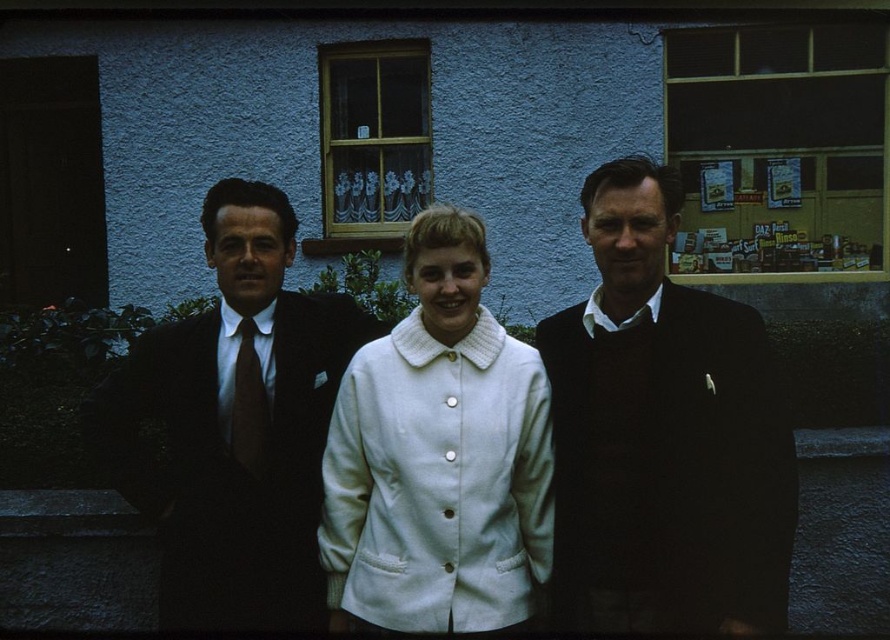
Does dark brown wool suit at center appear under satin brown tie at center?

Correct, dark brown wool suit at center is located below satin brown tie at center.

Describe the element at coordinates (231, 461) in the screenshot. This screenshot has height=640, width=890. I see `dark brown wool suit at center` at that location.

You are a GUI agent. You are given a task and a screenshot of the screen. Output one action in this format:
    pyautogui.click(x=<x>, y=<y>)
    Task: Click on the dark brown wool suit at center
    
    Given the screenshot: What is the action you would take?
    pyautogui.click(x=231, y=461)

Between dark brown sweater at center and dark brown wool suit at center, which one is positioned lower?

Positioned lower is dark brown wool suit at center.

Does dark brown sweater at center appear under dark brown wool suit at center?

Incorrect, dark brown sweater at center is not positioned below dark brown wool suit at center.

Which is in front, point (581, 419) or point (231, 451)?

Positioned in front is point (581, 419).

Locate an element on the screen. The image size is (890, 640). dark brown sweater at center is located at coordinates (662, 435).

What do you see at coordinates (662, 435) in the screenshot? I see `white wool coat at center` at bounding box center [662, 435].

Is white wool coat at center taller than dark brown sweater at center?

Yes.

What do you see at coordinates (662, 435) in the screenshot? The image size is (890, 640). I see `white wool coat at center` at bounding box center [662, 435].

The image size is (890, 640). I want to click on white wool coat at center, so click(x=662, y=435).